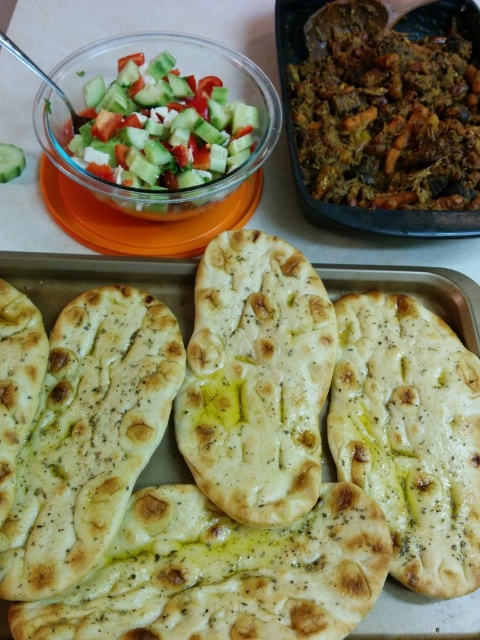
In the scene shown: You are planning to serve these flatbreads on a 12 inch diameter plate. Which flatbread between the olive oil brushed flatbread at center and the white soft flatbread at center would fit better on the plate?

The olive oil brushed flatbread at center has a smaller width than the white soft flatbread at center, so it would fit better on the 12 inch diameter plate.

You are a food stylist who needs to place a decorative herb sprig on the olive oil brushed flatbread at center. Considering the flatbread is 26.16 inches away from you, can you safely reach it without moving your position?

The olive oil brushed flatbread at center is 26.16 inches away from the viewer. Since the average human arm length is about 25 inches, you may need to stretch slightly but it should be reachable without moving your position.

You are a chef preparing a meal and need to place a 10 inch platter between the fresh green salad at upper left and the green cucumber at upper left. Will there be enough space?

The fresh green salad at upper left is 9.60 inches from the green cucumber at upper left. Since the distance between them is less than 10 inches, placing a 10 inch platter between them would not fit properly.